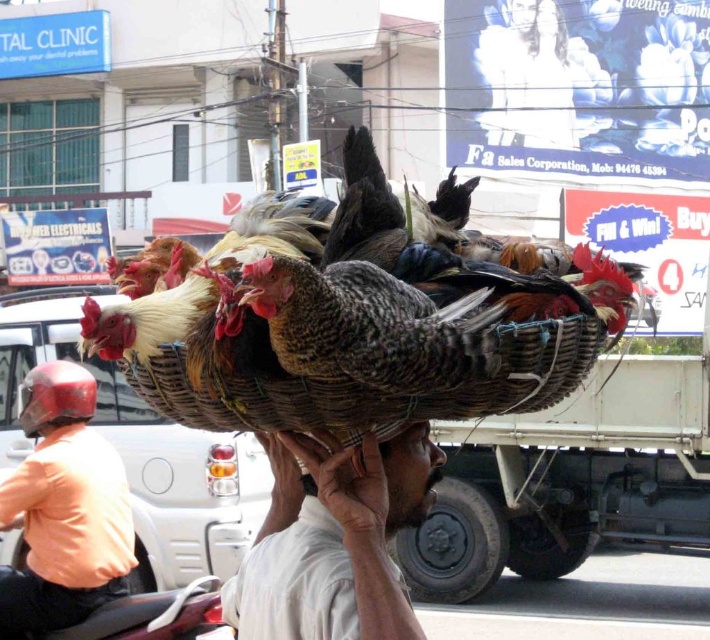
Does orange fabric helmet at upper left appear on the left side of brown woven basket at center?

Indeed, orange fabric helmet at upper left is positioned on the left side of brown woven basket at center.

Is point (21, 422) positioned behind point (409, 474)?

Yes.

I want to click on orange fabric helmet at upper left, so click(62, 508).

Does point (0, 522) come in front of point (327, 356)?

No, it is not.

This screenshot has width=710, height=640. What are the coordinates of `orange fabric helmet at upper left` in the screenshot? It's located at (62, 508).

Locate an element on the screen. orange fabric helmet at upper left is located at coordinates (62, 508).

The image size is (710, 640). I want to click on orange fabric helmet at upper left, so click(x=62, y=508).

Image resolution: width=710 pixels, height=640 pixels. What do you see at coordinates (333, 540) in the screenshot? I see `white woven basket at center` at bounding box center [333, 540].

Where is `white woven basket at center`? The height and width of the screenshot is (640, 710). white woven basket at center is located at coordinates (333, 540).